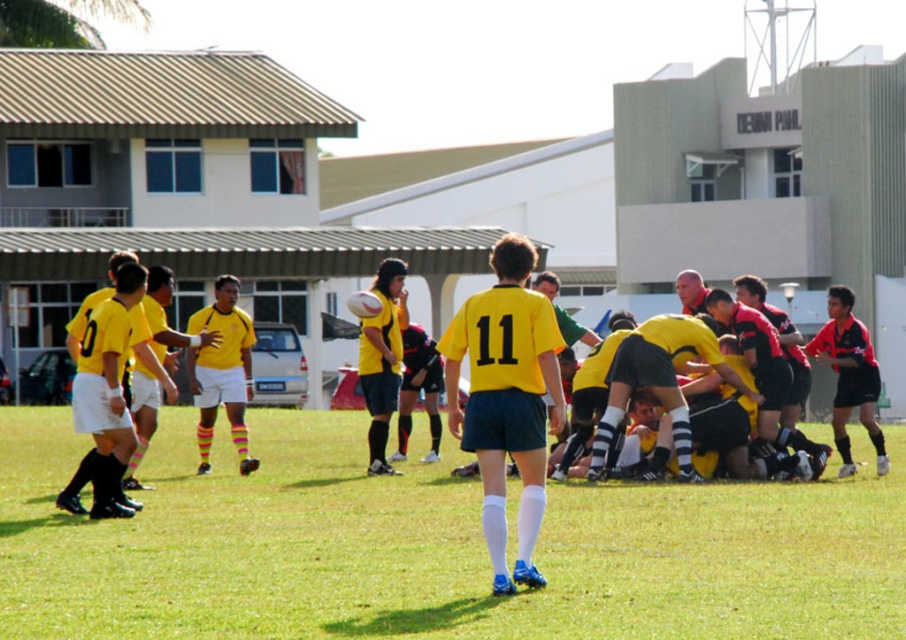
You are a player wearing a yellow jersey and black shorts. You want to pass the ball to your teammate who is standing at point (431, 548). What is at that location?

There is green grass at center at point (431, 548).